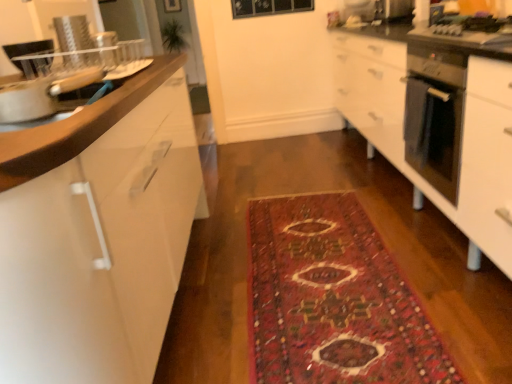
Question: Is metallic stainless steel gas stove at right positioned behind metallic stainless steel microwave at upper right?

Choices:
 (A) yes
 (B) no

Answer: (B)

Question: Is metallic stainless steel gas stove at right to the right of metallic stainless steel microwave at upper right from the viewer's perspective?

Choices:
 (A) yes
 (B) no

Answer: (B)

Question: Is metallic stainless steel microwave at upper right surrounded by metallic stainless steel gas stove at right?

Choices:
 (A) yes
 (B) no

Answer: (B)

Question: Can you confirm if metallic stainless steel gas stove at right is positioned to the left of metallic stainless steel microwave at upper right?

Choices:
 (A) no
 (B) yes

Answer: (B)

Question: Does metallic stainless steel gas stove at right come in front of metallic stainless steel microwave at upper right?

Choices:
 (A) yes
 (B) no

Answer: (A)

Question: From a real-world perspective, is metallic stainless steel gas stove at right beneath metallic stainless steel microwave at upper right?

Choices:
 (A) no
 (B) yes

Answer: (B)

Question: Can you confirm if satin silver oven at right is taller than metallic stainless steel microwave at upper right?

Choices:
 (A) no
 (B) yes

Answer: (B)

Question: Is satin silver oven at right at the right side of metallic stainless steel microwave at upper right?

Choices:
 (A) yes
 (B) no

Answer: (B)

Question: Is satin silver oven at right with metallic stainless steel microwave at upper right?

Choices:
 (A) yes
 (B) no

Answer: (B)

Question: Is metallic stainless steel microwave at upper right at the back of satin silver oven at right?

Choices:
 (A) no
 (B) yes

Answer: (A)

Question: Considering the relative sizes of satin silver oven at right and metallic stainless steel microwave at upper right in the image provided, is satin silver oven at right shorter than metallic stainless steel microwave at upper right?

Choices:
 (A) no
 (B) yes

Answer: (A)

Question: From a real-world perspective, does satin silver oven at right sit lower than metallic stainless steel microwave at upper right?

Choices:
 (A) yes
 (B) no

Answer: (A)

Question: From a real-world perspective, is satin silver oven at right below white glossy cabinet at left?

Choices:
 (A) yes
 (B) no

Answer: (B)